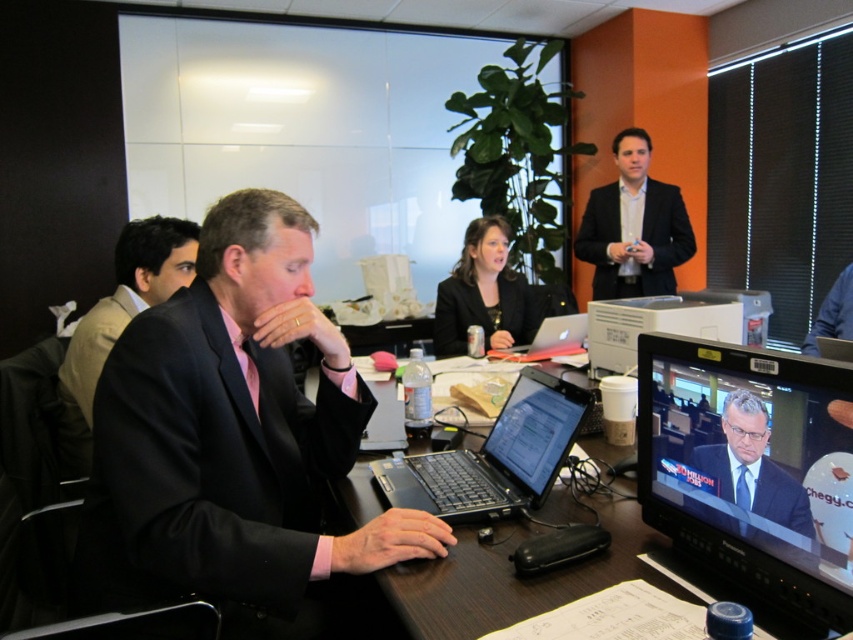
Question: Among these points, which one is nearest to the camera?

Choices:
 (A) (148, 248)
 (B) (251, 394)
 (C) (671, 284)
 (D) (659, 321)

Answer: (B)

Question: Which object is closer to the camera taking this photo?

Choices:
 (A) wooden desk at center
 (B) silver metallic laptop at center
 (C) blue silk tie at center

Answer: (A)

Question: Can you confirm if light brown suit at left is bigger than matte black suit at center?

Choices:
 (A) yes
 (B) no

Answer: (B)

Question: Observing the image, what is the correct spatial positioning of light brown suit at left in reference to silver metallic laptop at center?

Choices:
 (A) below
 (B) above

Answer: (B)

Question: Which object appears farthest from the camera in this image?

Choices:
 (A) dark blue suit at center
 (B) pink satin tie at center

Answer: (B)

Question: Does black matte jacket at center come behind blue silk tie at center?

Choices:
 (A) yes
 (B) no

Answer: (A)